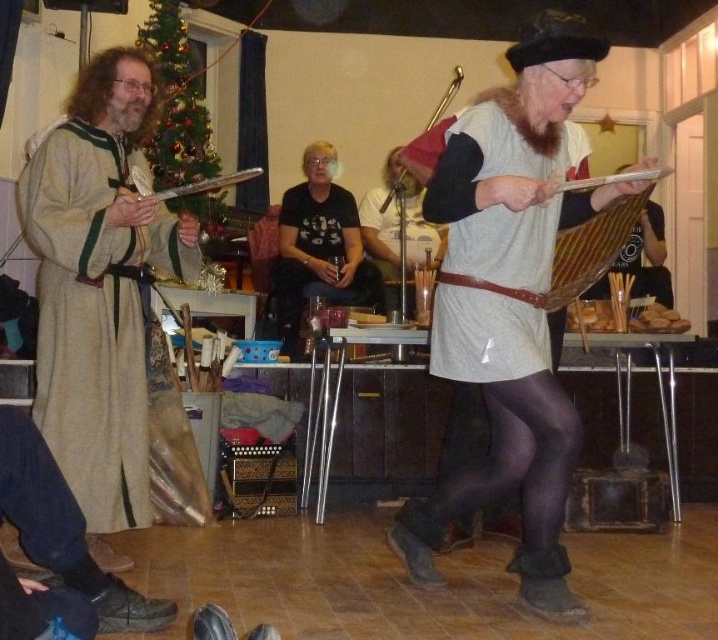
Looking at this image, you are a costume designer preparing for a play and need to ensure that the beige woolen robe at left and the black cotton shirt at center are displayed properly. Based on the scene description, which costume has a taller silhouette?

The beige woolen robe at left has a greater height compared to the black cotton shirt at center, so the beige woolen robe at left has a taller silhouette.

You are standing in the medieval event room and want to approach both the beige woolen robe at left and the black cotton shirt at center. Which one should you walk towards first to reach the closer one first?

You should walk towards the beige woolen robe at left first because it is closer to the viewer than the black cotton shirt at center.

Consider the image. You are attending a medieval festival and notice two items at the center of the stage. The matte gray tunic at center and the matte black microphone at center. Which one is nearer to you?

The matte gray tunic at center is closer to the viewer than the matte black microphone at center.